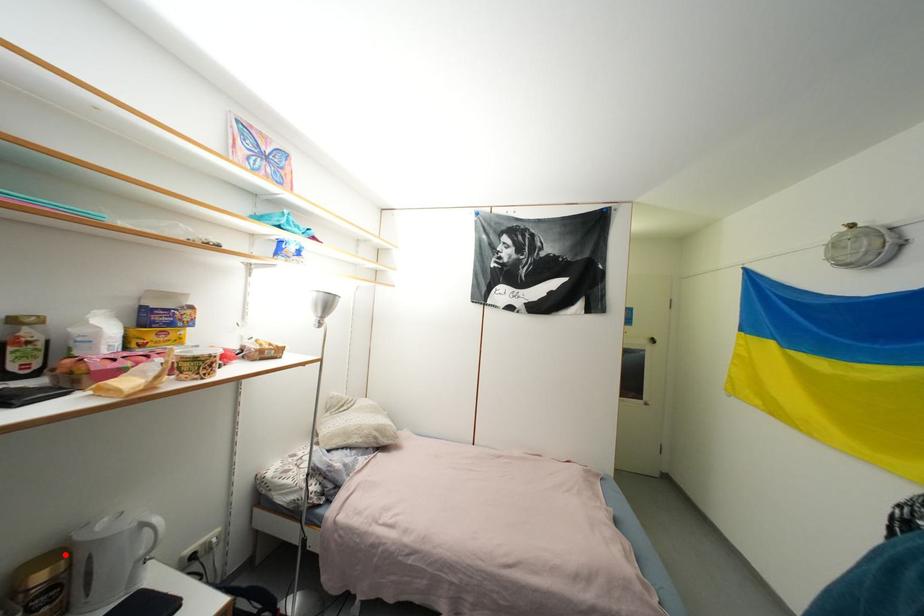
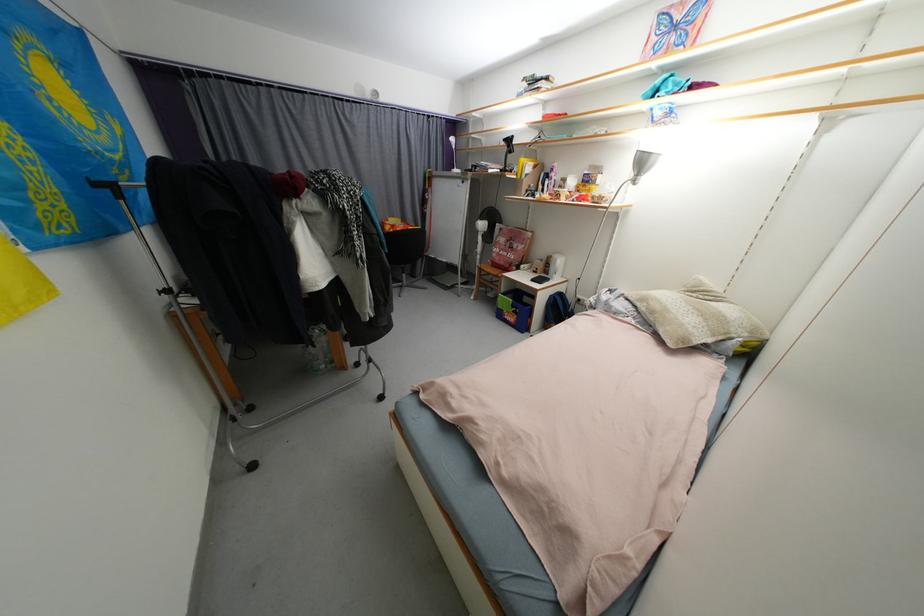
Question: A red point is marked in image1. In image2, is the corresponding 3D point closer to the camera or farther? Reply with the corresponding letter.

Choices:
 (A) The corresponding 3D point is closer.
 (B) The corresponding 3D point is farther.

Answer: (A)